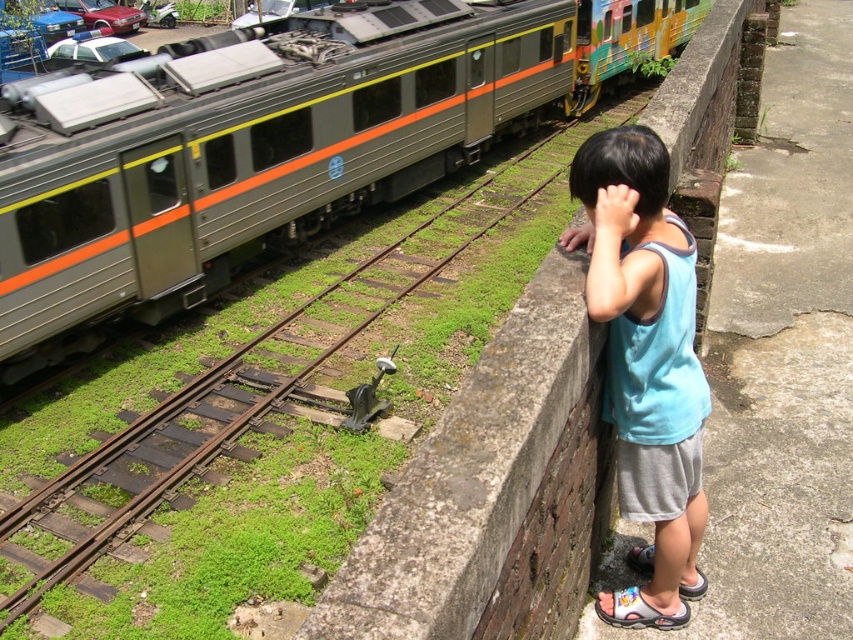
Is metallic gray train at upper left further to camera compared to blue cotton tank top at upper right?

Yes, metallic gray train at upper left is further from the viewer.

Which is more to the left, metallic gray train at upper left or blue cotton tank top at upper right?

Positioned to the left is metallic gray train at upper left.

Which is in front, point (529, 92) or point (604, 230)?

Point (604, 230) is in front.

The height and width of the screenshot is (640, 853). I want to click on metallic gray train at upper left, so click(x=268, y=144).